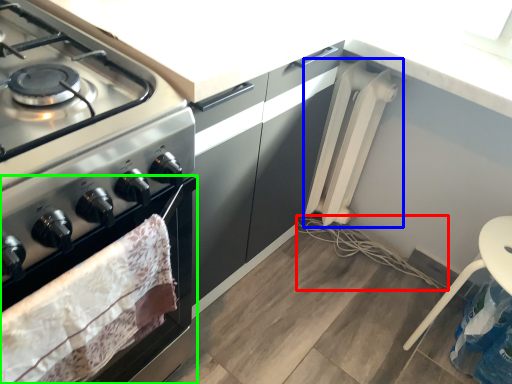
Question: Considering the real-world distances, which object is closest to string (highlighted by a red box)? appliance (highlighted by a blue box) or oven (highlighted by a green box).

Choices:
 (A) appliance
 (B) oven

Answer: (A)